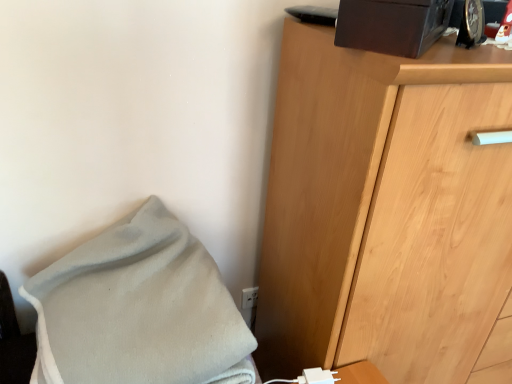
Question: Can you confirm if white plastic electric outlet at lower center is smaller than white fleece blanket at lower left?

Choices:
 (A) no
 (B) yes

Answer: (B)

Question: From the image's perspective, is white plastic electric outlet at lower center below white fleece blanket at lower left?

Choices:
 (A) no
 (B) yes

Answer: (B)

Question: Is white plastic electric outlet at lower center not near white fleece blanket at lower left?

Choices:
 (A) no
 (B) yes

Answer: (A)

Question: Is white plastic electric outlet at lower center bigger than white fleece blanket at lower left?

Choices:
 (A) yes
 (B) no

Answer: (B)

Question: Does white plastic electric outlet at lower center turn towards white fleece blanket at lower left?

Choices:
 (A) no
 (B) yes

Answer: (A)

Question: Is white fleece blanket at lower left to the left or to the right of light brown wooden chest of drawers at right in the image?

Choices:
 (A) right
 (B) left

Answer: (B)

Question: From the image's perspective, is white fleece blanket at lower left above or below light brown wooden chest of drawers at right?

Choices:
 (A) below
 (B) above

Answer: (A)

Question: Is point (246, 337) positioned closer to the camera than point (416, 294)?

Choices:
 (A) closer
 (B) farther

Answer: (A)

Question: Considering their positions, is white fleece blanket at lower left located in front of or behind light brown wooden chest of drawers at right?

Choices:
 (A) behind
 (B) front

Answer: (B)

Question: Is point (251, 286) closer or farther from the camera than point (389, 306)?

Choices:
 (A) closer
 (B) farther

Answer: (B)

Question: Is white plastic electric outlet at lower center situated inside light brown wooden chest of drawers at right or outside?

Choices:
 (A) inside
 (B) outside

Answer: (B)

Question: Considering the positions of white plastic electric outlet at lower center and light brown wooden chest of drawers at right in the image, is white plastic electric outlet at lower center wider or thinner than light brown wooden chest of drawers at right?

Choices:
 (A) wide
 (B) thin

Answer: (B)

Question: Based on their sizes in the image, would you say white plastic electric outlet at lower center is bigger or smaller than light brown wooden chest of drawers at right?

Choices:
 (A) small
 (B) big

Answer: (A)

Question: Visually, is light brown wooden chest of drawers at right positioned to the left or to the right of white fleece blanket at lower left?

Choices:
 (A) left
 (B) right

Answer: (B)

Question: In terms of height, does light brown wooden chest of drawers at right look taller or shorter compared to white fleece blanket at lower left?

Choices:
 (A) tall
 (B) short

Answer: (A)